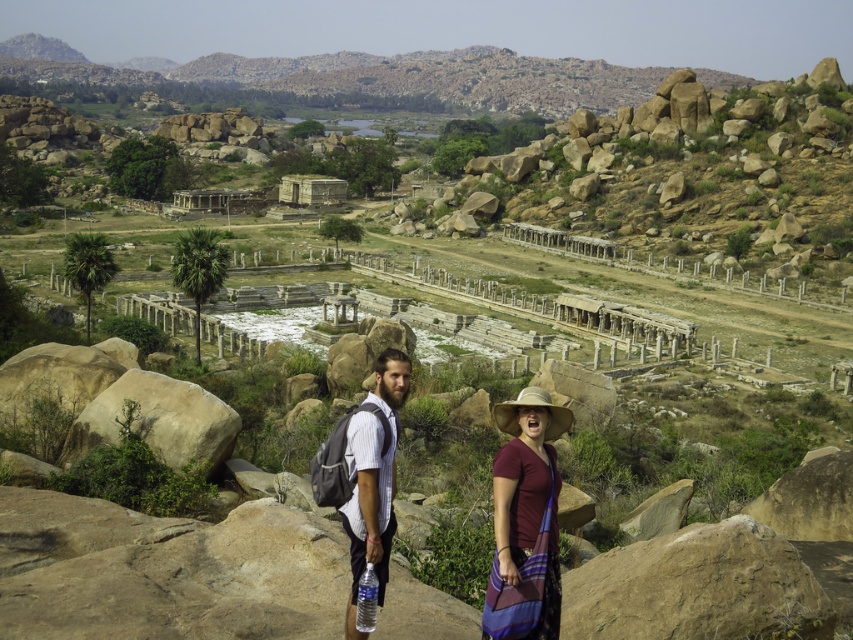
Question: Does matte white shirt at center appear under striped cotton shirt at center?

Choices:
 (A) yes
 (B) no

Answer: (B)

Question: Which point is farther from the camera taking this photo?

Choices:
 (A) (352, 538)
 (B) (363, 538)
 (C) (550, 410)

Answer: (C)

Question: Which object is positioned farthest from the rocky terrain at upper center?

Choices:
 (A) maroon fabric shirt at center
 (B) matte white shirt at center
 (C) straw hat at center

Answer: (C)

Question: Does matte white shirt at center appear on the left side of striped cotton shirt at center?

Choices:
 (A) no
 (B) yes

Answer: (A)

Question: Estimate the real-world distances between objects in this image. Which object is closer to the rocky terrain at upper center?

Choices:
 (A) straw hat at center
 (B) striped cotton shirt at center

Answer: (B)

Question: Can you confirm if matte white shirt at center is positioned below striped cotton shirt at center?

Choices:
 (A) no
 (B) yes

Answer: (A)